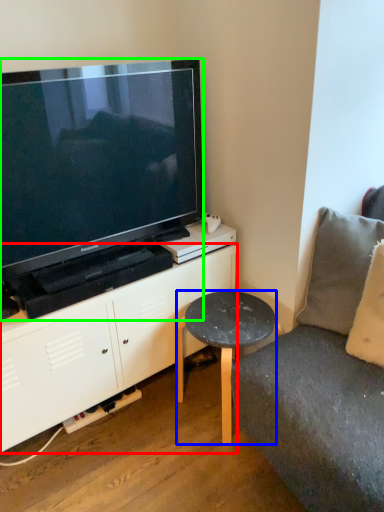
Question: Which object is the closest to the cabinetry (highlighted by a red box)? Choose among these: table (highlighted by a blue box) or television (highlighted by a green box).

Choices:
 (A) table
 (B) television

Answer: (A)